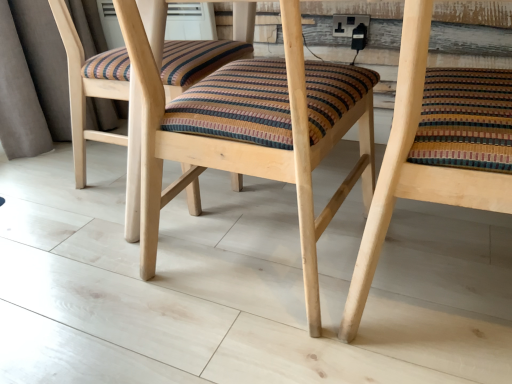
The width and height of the screenshot is (512, 384). Identify the location of wooden chair at center, the second chair positioned from the right. (253, 131).

This screenshot has height=384, width=512. What do you see at coordinates (253, 131) in the screenshot?
I see `wooden chair at center, the second chair positioned from the right` at bounding box center [253, 131].

You are a GUI agent. You are given a task and a screenshot of the screen. Output one action in this format:
    pyautogui.click(x=<x>, y=<y>)
    Task: Click on the wooden chair at center, which appears as the 2th chair when viewed from the left
    
    Given the screenshot: What is the action you would take?
    pyautogui.click(x=413, y=167)

The width and height of the screenshot is (512, 384). Describe the element at coordinates (413, 167) in the screenshot. I see `wooden chair at center, which appears as the 2th chair when viewed from the left` at that location.

Locate an element on the screen. This screenshot has width=512, height=384. wooden chair at center, the 1th chair viewed from the left is located at coordinates (253, 131).

Considering the relative positions of wooden chair at center, which appears as the 2th chair when viewed from the left, and wooden chair at center, the second chair positioned from the right, in the image provided, is wooden chair at center, which appears as the 2th chair when viewed from the left, to the left or to the right of wooden chair at center, the second chair positioned from the right,?

Clearly, wooden chair at center, which appears as the 2th chair when viewed from the left, is on the right of wooden chair at center, the second chair positioned from the right, in the image.

Is wooden chair at center, the first chair in the right-to-left sequence, closer to camera compared to wooden chair at center, the second chair positioned from the right?

Yes, wooden chair at center, the first chair in the right-to-left sequence, is closer to the camera.

Which is in front, point (465, 186) or point (285, 147)?

Positioned in front is point (465, 186).

From the image's perspective, which is above, wooden chair at center, which appears as the 2th chair when viewed from the left, or wooden chair at center, the 1th chair viewed from the left?

wooden chair at center, the 1th chair viewed from the left, is shown above in the image.

Consider the image. From a real-world perspective, is wooden chair at center, which appears as the 2th chair when viewed from the left, positioned over wooden chair at center, the 1th chair viewed from the left, based on gravity?

No.

Which object is wider, wooden chair at center, which appears as the 2th chair when viewed from the left, or wooden chair at center, the second chair positioned from the right?

Wider between the two is wooden chair at center, the second chair positioned from the right.

Does wooden chair at center, which appears as the 2th chair when viewed from the left, have a lesser height compared to wooden chair at center, the second chair positioned from the right?

Correct, wooden chair at center, which appears as the 2th chair when viewed from the left, is not as tall as wooden chair at center, the second chair positioned from the right.

Considering the sizes of wooden chair at center, the first chair in the right-to-left sequence, and wooden chair at center, the second chair positioned from the right, in the image, is wooden chair at center, the first chair in the right-to-left sequence, bigger or smaller than wooden chair at center, the second chair positioned from the right,?

In the image, wooden chair at center, the first chair in the right-to-left sequence, appears to be smaller than wooden chair at center, the second chair positioned from the right.

Is wooden chair at center, the first chair in the right-to-left sequence, located outside wooden chair at center, the second chair positioned from the right?

Yes, wooden chair at center, the first chair in the right-to-left sequence, is outside of wooden chair at center, the second chair positioned from the right.

Is wooden chair at center, the first chair in the right-to-left sequence, positioned far away from wooden chair at center, the 1th chair viewed from the left?

No, wooden chair at center, the first chair in the right-to-left sequence, is in close proximity to wooden chair at center, the 1th chair viewed from the left.

Is wooden chair at center, which appears as the 2th chair when viewed from the left, turned away from wooden chair at center, the 1th chair viewed from the left?

No, wooden chair at center, the 1th chair viewed from the left, is not at the back of wooden chair at center, which appears as the 2th chair when viewed from the left.

How different are the orientations of wooden chair at center, which appears as the 2th chair when viewed from the left, and wooden chair at center, the second chair positioned from the right, in degrees?

0.257 degrees.

How far apart are wooden chair at center, the first chair in the right-to-left sequence, and wooden chair at center, the second chair positioned from the right?

11.94 inches.

This screenshot has height=384, width=512. Find the location of `chair below the wooden chair at center, the second chair positioned from the right (from a real-world perspective)`. chair below the wooden chair at center, the second chair positioned from the right (from a real-world perspective) is located at coordinates (413, 167).

Considering the relative positions of wooden chair at center, the second chair positioned from the right, and wooden chair at center, which appears as the 2th chair when viewed from the left, in the image provided, is wooden chair at center, the second chair positioned from the right, to the right of wooden chair at center, which appears as the 2th chair when viewed from the left, from the viewer's perspective?

No, wooden chair at center, the second chair positioned from the right, is not to the right of wooden chair at center, which appears as the 2th chair when viewed from the left.

Which object is closer to the camera taking this photo, wooden chair at center, the second chair positioned from the right, or wooden chair at center, which appears as the 2th chair when viewed from the left?

wooden chair at center, which appears as the 2th chair when viewed from the left, is closer to the camera.

Between point (260, 98) and point (409, 52), which one is positioned in front?

Positioned in front is point (409, 52).

From the image's perspective, which one is positioned higher, wooden chair at center, the second chair positioned from the right, or wooden chair at center, the first chair in the right-to-left sequence?

wooden chair at center, the second chair positioned from the right, is shown above in the image.

Based on the photo, from a real-world perspective, does wooden chair at center, the 1th chair viewed from the left, sit lower than wooden chair at center, which appears as the 2th chair when viewed from the left?

No, from a real-world perspective, wooden chair at center, the 1th chair viewed from the left, is not beneath wooden chair at center, which appears as the 2th chair when viewed from the left.

Considering the sizes of objects wooden chair at center, the second chair positioned from the right, and wooden chair at center, the first chair in the right-to-left sequence, in the image provided, who is thinner, wooden chair at center, the second chair positioned from the right, or wooden chair at center, the first chair in the right-to-left sequence,?

Thinner between the two is wooden chair at center, the first chair in the right-to-left sequence.

Based on the photo, is wooden chair at center, the second chair positioned from the right, taller than wooden chair at center, the first chair in the right-to-left sequence?

Yes, wooden chair at center, the second chair positioned from the right, is taller than wooden chair at center, the first chair in the right-to-left sequence.

Consider the image. Is wooden chair at center, the second chair positioned from the right, bigger or smaller than wooden chair at center, which appears as the 2th chair when viewed from the left?

Clearly, wooden chair at center, the second chair positioned from the right, is larger in size than wooden chair at center, which appears as the 2th chair when viewed from the left.

Consider the image. Would you say wooden chair at center, the second chair positioned from the right, is outside wooden chair at center, which appears as the 2th chair when viewed from the left?

Yes, wooden chair at center, the second chair positioned from the right, is not within wooden chair at center, which appears as the 2th chair when viewed from the left.

Is wooden chair at center, the 1th chair viewed from the left, directly adjacent to wooden chair at center, which appears as the 2th chair when viewed from the left?

No, wooden chair at center, the 1th chair viewed from the left, is not with wooden chair at center, which appears as the 2th chair when viewed from the left.

Is wooden chair at center, the 1th chair viewed from the left, positioned with its back to wooden chair at center, which appears as the 2th chair when viewed from the left?

No, wooden chair at center, the 1th chair viewed from the left, is not facing the opposite direction of wooden chair at center, which appears as the 2th chair when viewed from the left.

At what (x,y) coordinates should I click in order to perform the action: click on chair that is above the wooden chair at center, the first chair in the right-to-left sequence (from the image's perspective). Please return your answer as a coordinate pair (x, y). Looking at the image, I should click on (253, 131).

Identify the location of chair below the wooden chair at center, the second chair positioned from the right (from a real-world perspective). (413, 167).

Identify the location of chair on the left of the wooden chair at center, the first chair in the right-to-left sequence. This screenshot has height=384, width=512. (253, 131).